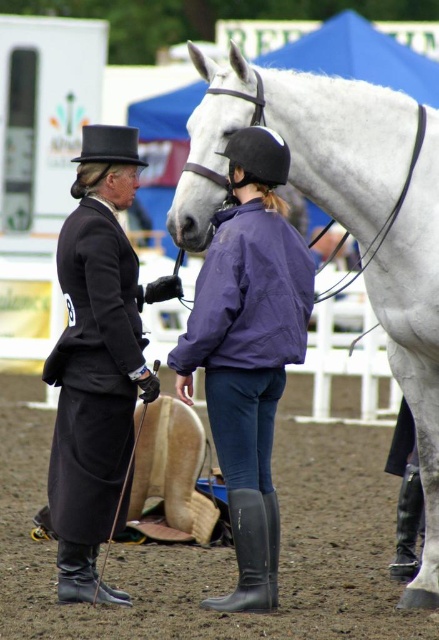
You are a photographer at the equestrian event. You want to take a photo focusing on the black leather jacket at left and the black felt dress hat at upper left. Which object should you adjust your camera focus on first if you want to ensure both are in focus?

The black leather jacket at left is closer to the viewer than the black felt dress hat at upper left, so you should focus on the black leather jacket at left first to ensure both are in focus.

Based on the photo, you are a photographer at the equestrian event and want to capture a closeup of the black rubber boot at lower right. According to the coordinates provided, where should you focus your camera?

The black rubber boot at lower right is located at point (407, 524), so you should focus your camera there.